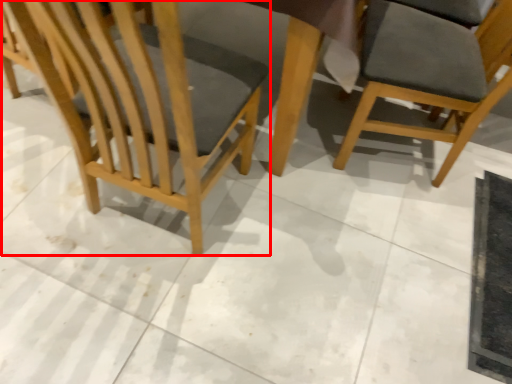
Question: Observing the image, what is the correct spatial positioning of chair (annotated by the red box) in reference to chair?

Choices:
 (A) left
 (B) right

Answer: (A)